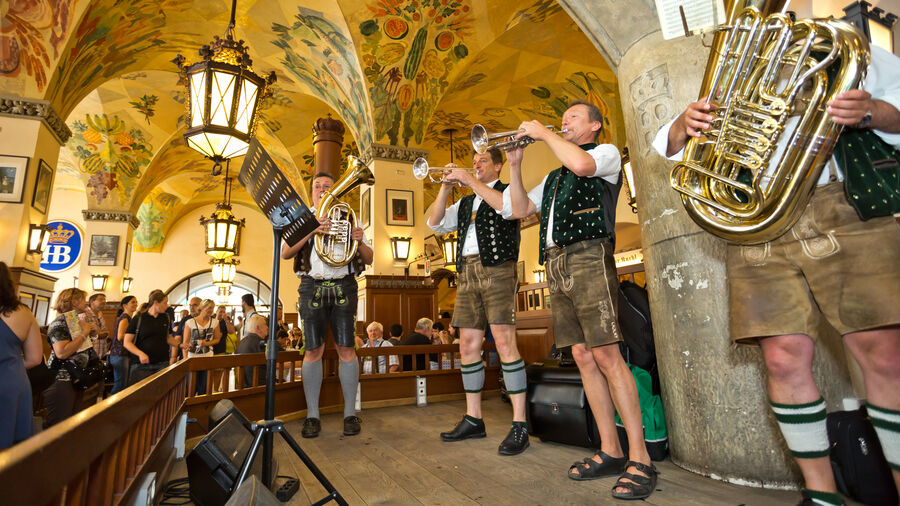
Find the location of a particular element. picture on wall is located at coordinates (11, 175), (42, 182), (103, 251), (126, 256), (396, 205), (362, 208).